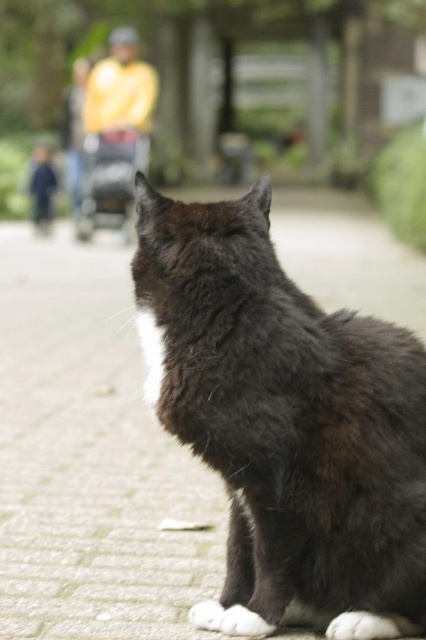
Question: Is black fur cat at center thinner than yellow fabric jacket at upper left?

Choices:
 (A) no
 (B) yes

Answer: (B)

Question: Is the position of black fur cat at center less distant than that of yellow fabric jacket at upper left?

Choices:
 (A) yes
 (B) no

Answer: (A)

Question: Does black fur cat at center appear over yellow fabric jacket at upper left?

Choices:
 (A) no
 (B) yes

Answer: (A)

Question: Which point is closer to the camera taking this photo?

Choices:
 (A) (255, 472)
 (B) (147, 131)

Answer: (A)